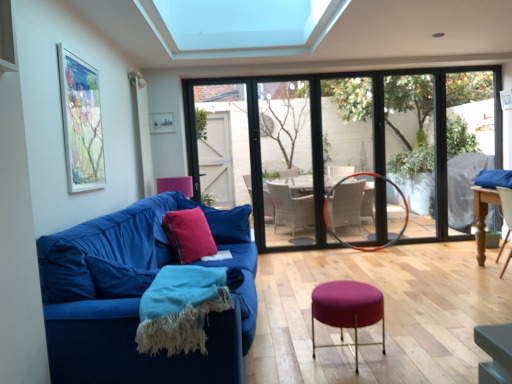
Question: Should I look upward or downward to see velvet blue couch at left?

Choices:
 (A) up
 (B) down

Answer: (B)

Question: Considering the relative sizes of velvet red pillow at center and transparent glass window at center in the image provided, is velvet red pillow at center wider than transparent glass window at center?

Choices:
 (A) no
 (B) yes

Answer: (B)

Question: From a real-world perspective, is velvet red pillow at center beneath transparent glass window at center?

Choices:
 (A) yes
 (B) no

Answer: (A)

Question: Is velvet red pillow at center aimed at transparent glass window at center?

Choices:
 (A) no
 (B) yes

Answer: (A)

Question: Is velvet red pillow at center positioned beyond the bounds of transparent glass window at center?

Choices:
 (A) yes
 (B) no

Answer: (A)

Question: Is velvet red pillow at center smaller than transparent glass window at center?

Choices:
 (A) no
 (B) yes

Answer: (B)

Question: Is velvet red pillow at center positioned with its back to transparent glass window at center?

Choices:
 (A) no
 (B) yes

Answer: (B)

Question: Is velvet blue couch at left at the back of clear glass door at center?

Choices:
 (A) yes
 (B) no

Answer: (B)

Question: Considering the relative positions of clear glass door at center and velvet blue couch at left in the image provided, is clear glass door at center to the right of velvet blue couch at left from the viewer's perspective?

Choices:
 (A) yes
 (B) no

Answer: (A)

Question: Considering the relative sizes of clear glass door at center and velvet blue couch at left in the image provided, is clear glass door at center bigger than velvet blue couch at left?

Choices:
 (A) yes
 (B) no

Answer: (B)

Question: From the image's perspective, does clear glass door at center appear lower than velvet blue couch at left?

Choices:
 (A) yes
 (B) no

Answer: (B)

Question: Is clear glass door at center closer to the viewer compared to velvet blue couch at left?

Choices:
 (A) no
 (B) yes

Answer: (A)

Question: Considering the relative sizes of clear glass door at center and velvet blue couch at left in the image provided, is clear glass door at center wider than velvet blue couch at left?

Choices:
 (A) yes
 (B) no

Answer: (B)

Question: Does velvet blue couch at left appear on the right side of purple fabric stool at center?

Choices:
 (A) yes
 (B) no

Answer: (B)